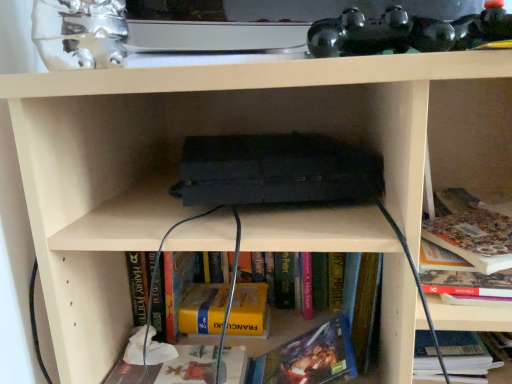
Question: From a real-world perspective, is hardcover book at lower center, positioned as the 2th book in right-to-left order, physically located above or below matte paper book at lower center, which is counted as the 4th book, starting from the right?

Choices:
 (A) below
 (B) above

Answer: (B)

Question: From the image's perspective, is hardcover book at lower center, the 3th book positioned from the left, positioned above or below matte paper book at lower center, which is counted as the 4th book, starting from the right?

Choices:
 (A) above
 (B) below

Answer: (A)

Question: Estimate the real-world distances between objects in this image. Which object is farther from the yellow matte book at center, the third book when ordered from right to left?

Choices:
 (A) matte paper book at lower center, which ranks as the first book in left-to-right order
 (B) hardcover book at lower center, the 3th book positioned from the left
 (C) hardcover book at lower right, which is counted as the first book, starting from the right

Answer: (C)

Question: Estimate the real-world distances between objects in this image. Which object is farther from the matte paper book at lower center, which ranks as the first book in left-to-right order?

Choices:
 (A) yellow matte book at center, which is the 2th book in left-to-right order
 (B) hardcover book at lower center, the 3th book positioned from the left
 (C) hardcover book at lower right, which is counted as the fourth book, starting from the left

Answer: (C)